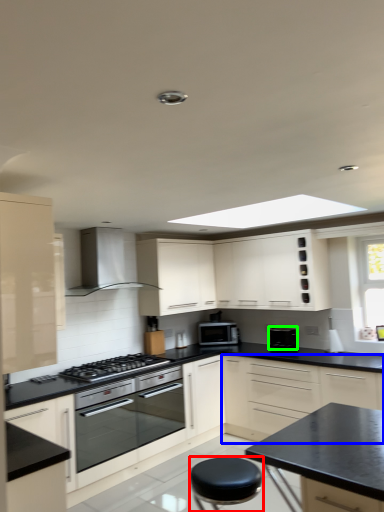
Question: Considering the real-world distances, which object is farthest from stool (highlighted by a red box)? cabinetry (highlighted by a blue box) or appliance (highlighted by a green box)?

Choices:
 (A) cabinetry
 (B) appliance

Answer: (B)